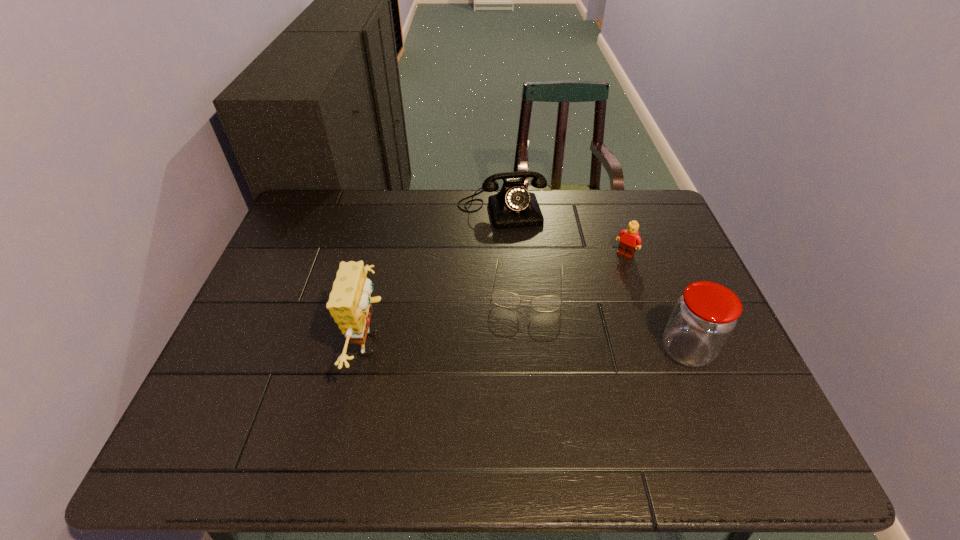
This screenshot has height=540, width=960. In order to click on free space on the desktop that is between the tallest object and the fourth shortest object and is positioned on the front face of the farthest object in this screenshot , I will do `click(539, 347)`.

I want to click on free space on the desktop that is between the leftmost object and the jar and is positioned on the face of the Lego, so click(x=544, y=347).

Locate an element on the screen. Image resolution: width=960 pixels, height=540 pixels. vacant space on the desktop that is between the leftmost object and the jar and is positioned on the front-facing side of the shortest object is located at coordinates pyautogui.click(x=522, y=347).